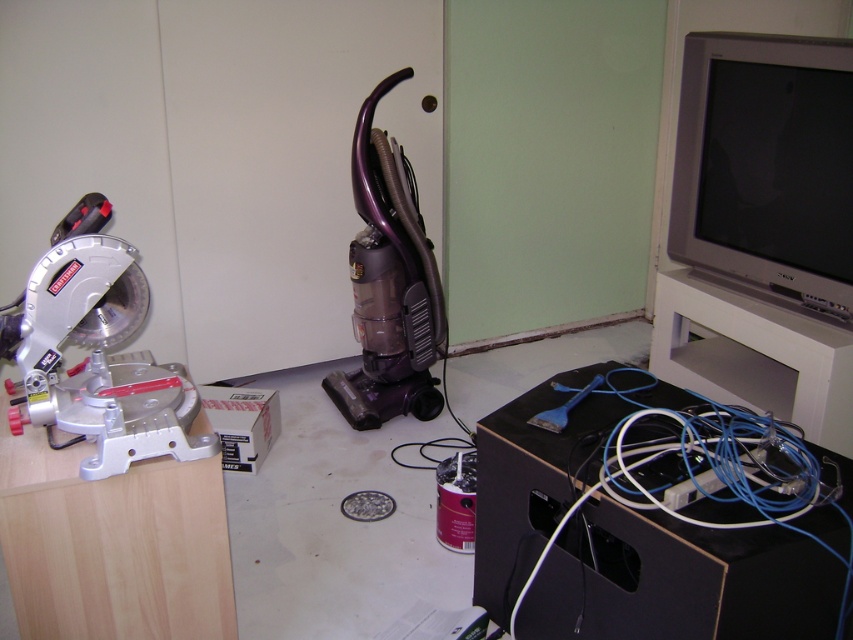
You are a delivery person who just arrived at this location with a new tool that needs to be placed exactly halfway between the silver metallic miter saw at left and the purple plastic vacuum cleaner at center. Where should you position the new tool?

The new tool should be placed exactly halfway between the silver metallic miter saw at left and the purple plastic vacuum cleaner at center, which would be at a distance of 0.61 meters from each object since the total distance between them is 1.22 meters.

Please provide the coordinates of the silver metallic miter saw at left in the image. The coordinates should be in the format of a point with two decimal places, like point (97,352). The answer must be precise and not approximate.

The silver metallic miter saw at left is located at point (97,352).